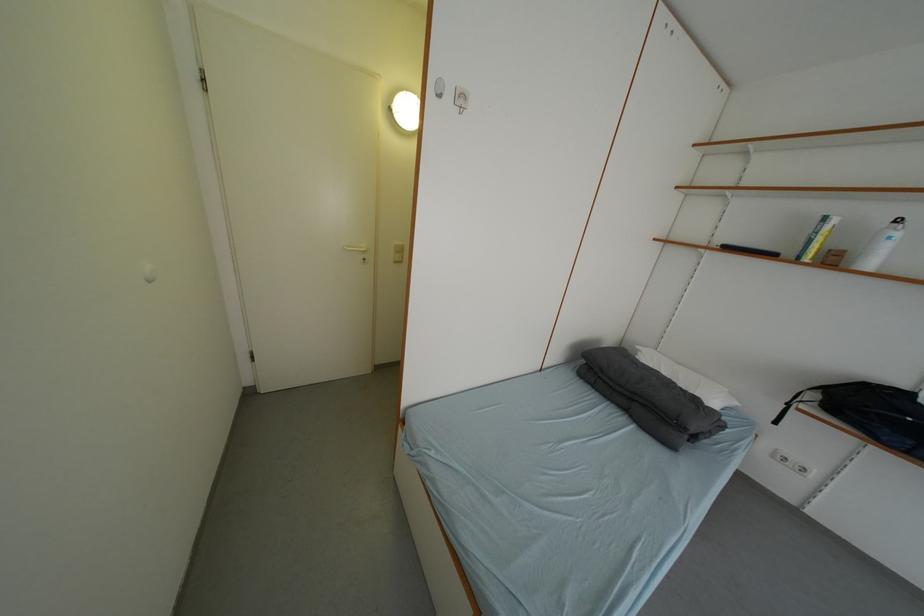
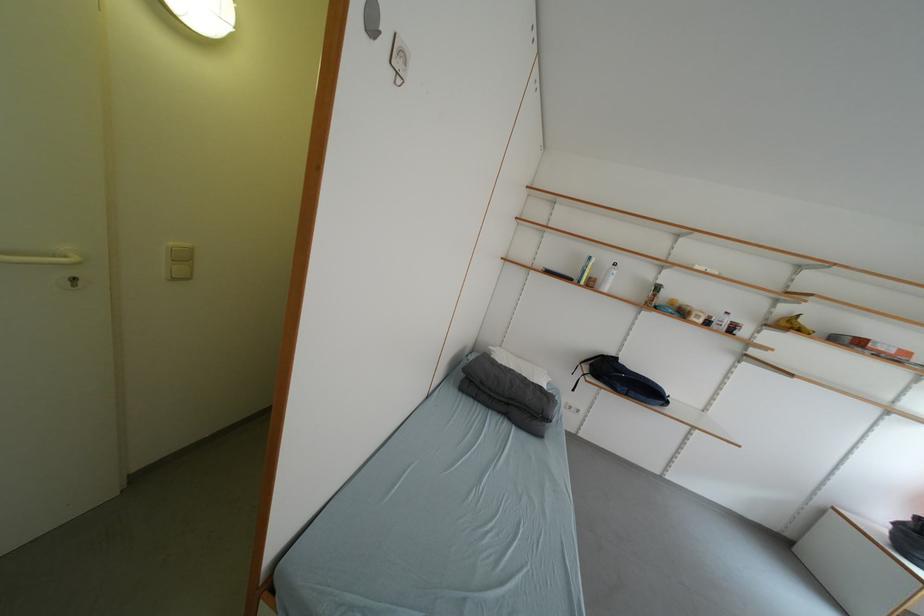
Question: The camera is either moving clockwise (left) or counter-clockwise (right) around the object. The first image is from the beginning of the video and the second image is from the end. Is the camera moving left or right when shooting the video?

Choices:
 (A) Left
 (B) Right

Answer: (A)